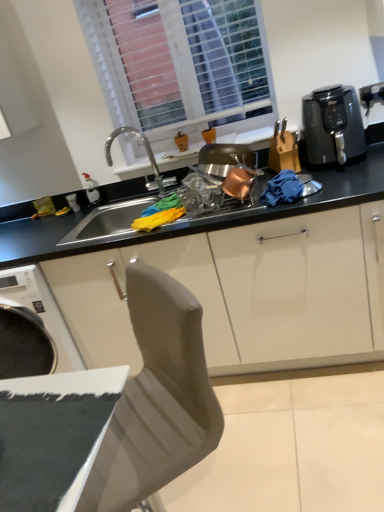
Question: From the image's perspective, relative to white plastic window at upper center, is black plastic knife block at right above or below?

Choices:
 (A) above
 (B) below

Answer: (B)

Question: Looking at the image, does black plastic knife block at right seem bigger or smaller compared to white plastic window at upper center?

Choices:
 (A) small
 (B) big

Answer: (A)

Question: Considering the real-world distances, which object is closest to the black plastic knife block at right?

Choices:
 (A) black plastic air fryer at upper right
 (B) black matte countertop at center
 (C) white plastic window at upper center

Answer: (A)

Question: Estimate the real-world distances between objects in this image. Which object is closer to the black plastic air fryer at upper right?

Choices:
 (A) white plastic window at upper center
 (B) black matte countertop at center
 (C) black plastic knife block at right

Answer: (C)